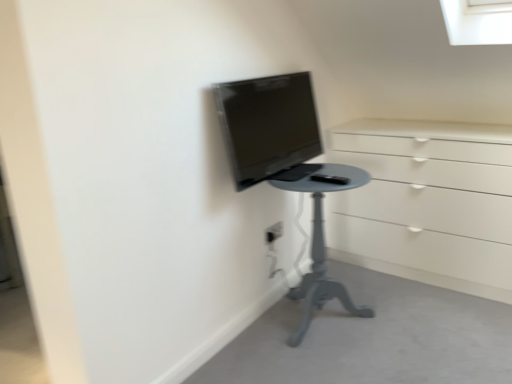
In order to face white plastic electric outlet at center, should I rotate leftwards or rightwards?

You should look right and rotate roughly 2.326 degrees.

Where is `smooth gray table at lower center`? smooth gray table at lower center is located at coordinates click(x=374, y=338).

Considering the sizes of matte black monitor at center and smooth gray table at lower center in the image, is matte black monitor at center taller or shorter than smooth gray table at lower center?

In the image, matte black monitor at center appears to be taller than smooth gray table at lower center.

From a real-world perspective, which is physically above, matte black monitor at center or smooth gray table at lower center?

matte black monitor at center is physically above.

How many degrees apart are the facing directions of matte black monitor at center and smooth gray table at lower center?

The facing directions of matte black monitor at center and smooth gray table at lower center are 90 degrees apart.

You are a GUI agent. You are given a task and a screenshot of the screen. Output one action in this format:
    pyautogui.click(x=<x>, y=<y>)
    Task: Click on the concrete on the right of matte black monitor at center
    The image size is (512, 384).
    Given the screenshot: What is the action you would take?
    pyautogui.click(x=374, y=338)

Is the depth of smooth gray table at lower center less than that of white plastic electric outlet at center?

Yes, it is in front of white plastic electric outlet at center.

Which point is more forward, (293, 370) or (277, 231)?

The point (293, 370) is closer to the camera.

Is smooth gray table at lower center turned away from white plastic electric outlet at center?

No, smooth gray table at lower center is not facing away from white plastic electric outlet at center.

From the picture: Considering the sizes of smooth gray table at lower center and white plastic electric outlet at center in the image, is smooth gray table at lower center wider or thinner than white plastic electric outlet at center?

smooth gray table at lower center is wider than white plastic electric outlet at center.

Considering the sizes of matte gray table at center and white plastic electric outlet at center in the image, is matte gray table at center taller or shorter than white plastic electric outlet at center?

matte gray table at center is taller than white plastic electric outlet at center.

Is matte gray table at center facing towards white plastic electric outlet at center?

Yes, matte gray table at center is facing white plastic electric outlet at center.

Which of these two, matte gray table at center or white plastic electric outlet at center, is wider?

matte gray table at center.

From the image's perspective, is matte gray table at center on top of white plastic electric outlet at center?

No, from the image's perspective, matte gray table at center is not over white plastic electric outlet at center.

How many degrees apart are the facing directions of white plastic electric outlet at center and matte black monitor at center?

The angular difference between white plastic electric outlet at center and matte black monitor at center is 0.415 degrees.

Based on the photo, do you think white plastic electric outlet at center is within matte black monitor at center, or outside of it?

white plastic electric outlet at center cannot be found inside matte black monitor at center.

Considering the sizes of objects white plastic electric outlet at center and matte black monitor at center in the image provided, who is thinner, white plastic electric outlet at center or matte black monitor at center?

white plastic electric outlet at center is thinner.

Identify the location of computer monitor in front of the white plastic electric outlet at center. (268, 125).

Looking at this image, does matte black monitor at center have a smaller size compared to white plastic electric outlet at center?

No, matte black monitor at center is not smaller than white plastic electric outlet at center.

From the image's perspective, does matte black monitor at center appear lower than white plastic electric outlet at center?

Incorrect, from the image's perspective, matte black monitor at center is higher than white plastic electric outlet at center.

Which object is more forward, matte black monitor at center or white plastic electric outlet at center?

matte black monitor at center is closer to the camera.

Does matte black monitor at center turn towards white plastic electric outlet at center?

No, matte black monitor at center is not facing towards white plastic electric outlet at center.

This screenshot has height=384, width=512. In order to click on computer monitor above the matte gray table at center (from a real-world perspective) in this screenshot , I will do pyautogui.click(x=268, y=125).

From the picture: Considering the relative sizes of matte gray table at center and matte black monitor at center in the image provided, is matte gray table at center wider than matte black monitor at center?

Yes, matte gray table at center is wider than matte black monitor at center.

Are matte gray table at center and matte black monitor at center located far from each other?

matte gray table at center is near matte black monitor at center, not far away.

Considering the positions of point (289, 295) and point (297, 108), is point (289, 295) closer or farther from the camera than point (297, 108)?

Point (289, 295).

Considering the sizes of objects smooth gray table at lower center and matte black monitor at center in the image provided, who is taller, smooth gray table at lower center or matte black monitor at center?

With more height is matte black monitor at center.

Is smooth gray table at lower center at the left side of matte black monitor at center?

No, smooth gray table at lower center is not to the left of matte black monitor at center.

Consider the image. Is matte black monitor at center located within smooth gray table at lower center?

No, smooth gray table at lower center does not contain matte black monitor at center.

From a real-world perspective, is smooth gray table at lower center above or below matte black monitor at center?

smooth gray table at lower center is situated lower than matte black monitor at center in the real world.

Where is `concrete that appears on the right of matte black monitor at center`? concrete that appears on the right of matte black monitor at center is located at coordinates (374, 338).

The width and height of the screenshot is (512, 384). In order to click on electric outlet lying on the left of smooth gray table at lower center in this screenshot , I will do `click(274, 232)`.

From the image, which object appears to be farther from smooth gray table at lower center, matte black monitor at center or white plastic electric outlet at center?

Based on the image, matte black monitor at center appears to be further to smooth gray table at lower center.

Looking at the image, which one is located further to smooth gray table at lower center, matte gray table at center or white plastic electric outlet at center?

Based on the image, white plastic electric outlet at center appears to be further to smooth gray table at lower center.

Which object lies nearer to the anchor point matte gray table at center, white plastic electric outlet at center or smooth gray table at lower center?

Among the two, smooth gray table at lower center is located nearer to matte gray table at center.

Looking at the image, which one is located closer to smooth gray table at lower center, white plastic electric outlet at center or matte gray table at center?

Among the two, matte gray table at center is located nearer to smooth gray table at lower center.

Which object lies further to the anchor point smooth gray table at lower center, white plastic electric outlet at center or matte black monitor at center?

The object further to smooth gray table at lower center is matte black monitor at center.

When comparing their distances from white plastic electric outlet at center, does matte gray table at center or matte black monitor at center seem further?

matte black monitor at center is further to white plastic electric outlet at center.

When comparing their distances from matte black monitor at center, does matte gray table at center or smooth gray table at lower center seem further?

smooth gray table at lower center lies further to matte black monitor at center than the other object.

When comparing their distances from matte gray table at center, does matte black monitor at center or smooth gray table at lower center seem closer?

smooth gray table at lower center is closer to matte gray table at center.

Image resolution: width=512 pixels, height=384 pixels. What are the coordinates of `furniture positioned between smooth gray table at lower center and white plastic electric outlet at center from near to far` in the screenshot? It's located at [319, 236].

Find the location of a particular element. The image size is (512, 384). furniture that lies between matte black monitor at center and smooth gray table at lower center from top to bottom is located at coordinates (319, 236).

The width and height of the screenshot is (512, 384). I want to click on furniture between matte black monitor at center and white plastic electric outlet at center along the z-axis, so click(x=319, y=236).

Where is `computer monitor between smooth gray table at lower center and white plastic electric outlet at center from front to back`? computer monitor between smooth gray table at lower center and white plastic electric outlet at center from front to back is located at coordinates (268, 125).